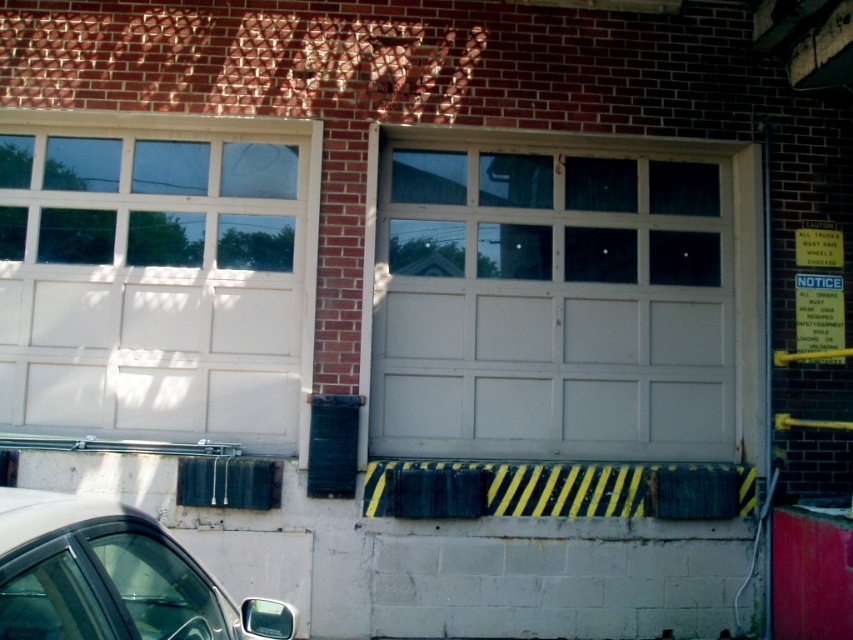
Question: Among these objects, which one is farthest from the camera?

Choices:
 (A) metallic red barrier at lower right
 (B) shiny silver car at lower left

Answer: (A)

Question: Which object appears closest to the camera in this image?

Choices:
 (A) metallic red barrier at lower right
 (B) white painted wood window at upper left

Answer: (A)

Question: Which point is closer to the camera?

Choices:
 (A) white painted wood window at upper left
 (B) white painted wood door at center
 (C) metallic red barrier at lower right

Answer: (C)

Question: Is white painted wood window at upper left wider than metallic red barrier at lower right?

Choices:
 (A) yes
 (B) no

Answer: (A)

Question: Is shiny silver car at lower left bigger than metallic red barrier at lower right?

Choices:
 (A) yes
 (B) no

Answer: (A)

Question: Is white painted wood door at center to the right of metallic red barrier at lower right from the viewer's perspective?

Choices:
 (A) yes
 (B) no

Answer: (B)